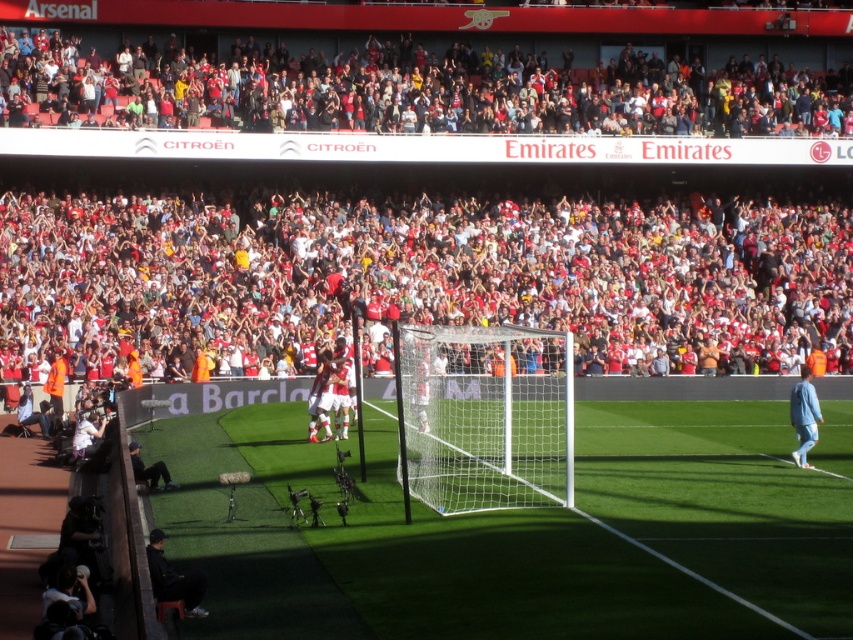
Between red fabric crowd at upper center and blue fabric jersey at right, which one appears on the right side from the viewer's perspective?

blue fabric jersey at right is more to the right.

Between red fabric crowd at upper center and blue fabric jersey at right, which one has more height?

red fabric crowd at upper center is taller.

This screenshot has height=640, width=853. I want to click on red fabric crowd at upper center, so coord(409,90).

Identify the location of red fabric crowd at upper center. The height and width of the screenshot is (640, 853). (409, 90).

Which is behind, point (428, 570) or point (189, 120)?

Positioned behind is point (189, 120).

Between green artificial turf at center and red fabric crowd at upper center, which one is positioned lower?

green artificial turf at center is below.

Locate an element on the screen. This screenshot has height=640, width=853. green artificial turf at center is located at coordinates [x=561, y=525].

Does white mesh net at center lie behind blue fabric jersey at right?

No, it is in front of blue fabric jersey at right.

Who is positioned more to the left, white mesh net at center or blue fabric jersey at right?

white mesh net at center is more to the left.

Between point (556, 442) and point (790, 413), which one is positioned in front?

Positioned in front is point (790, 413).

At what (x,y) coordinates should I click in order to perform the action: click on white mesh net at center. Please return your answer as a coordinate pair (x, y). This screenshot has width=853, height=640. Looking at the image, I should click on (486, 417).